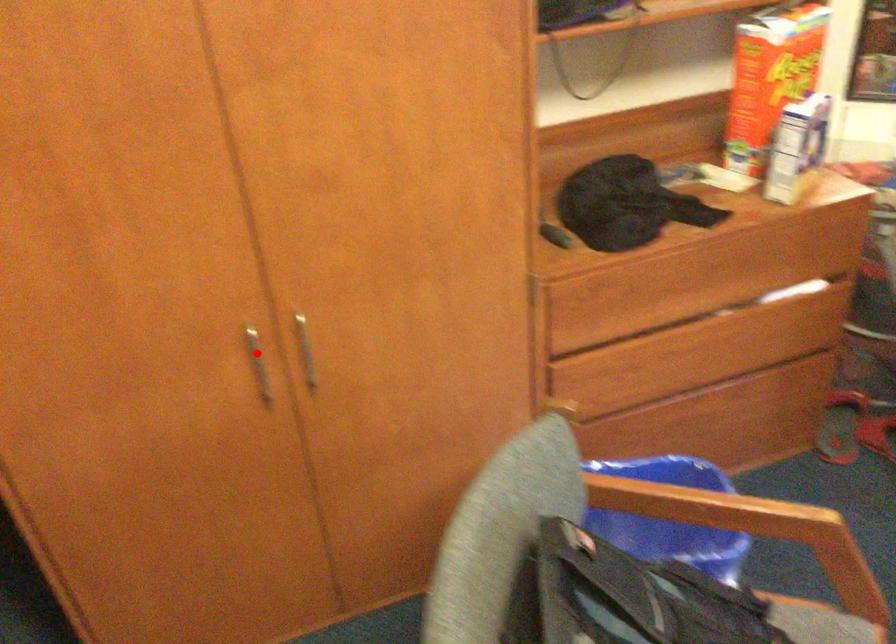
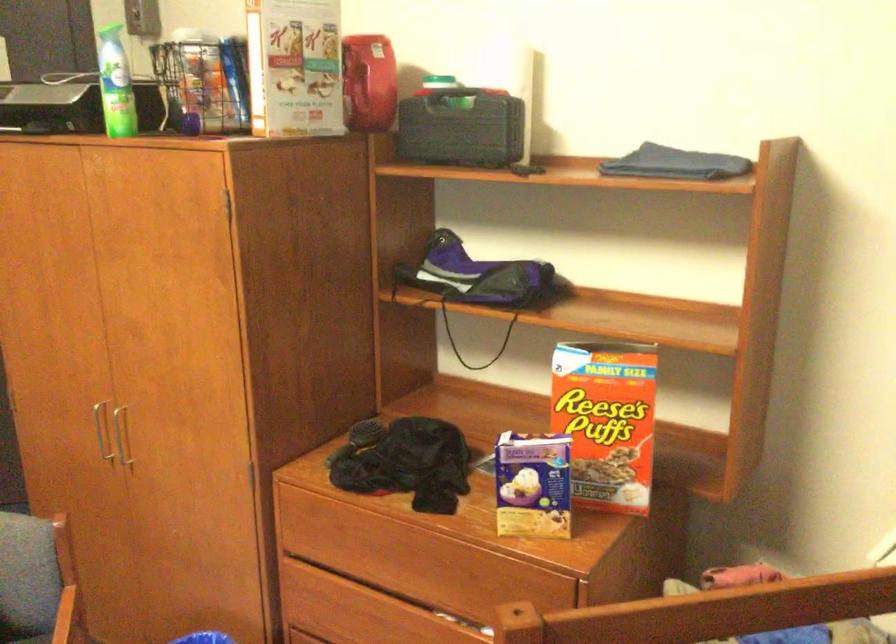
Question: I am providing you with two images of the same scene from different viewpoints. A red point is marked on the first image. Can you still see the location of the red point in image 2?

Choices:
 (A) Yes
 (B) No

Answer: (A)